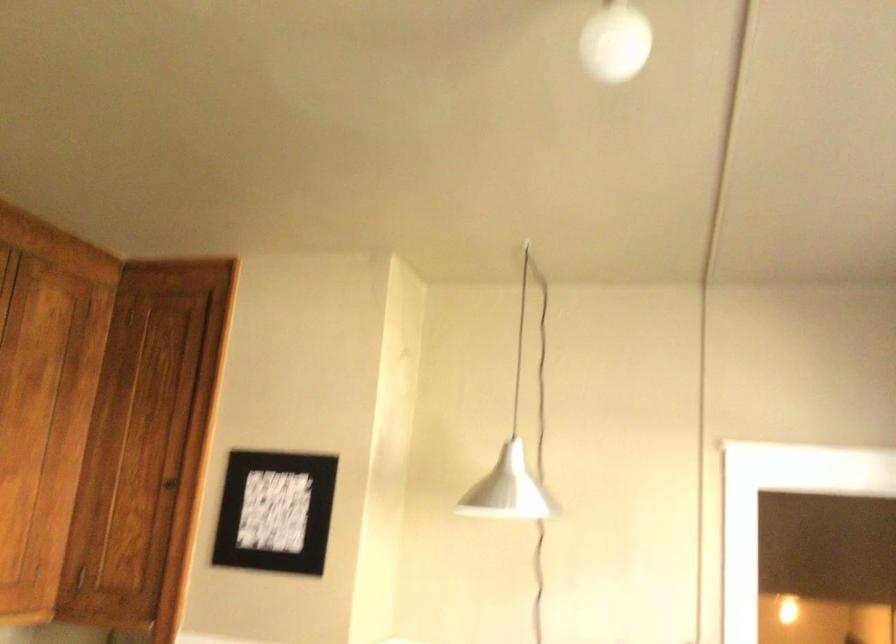
The image size is (896, 644). What do you see at coordinates (23, 397) in the screenshot?
I see `a wooden cabinet door` at bounding box center [23, 397].